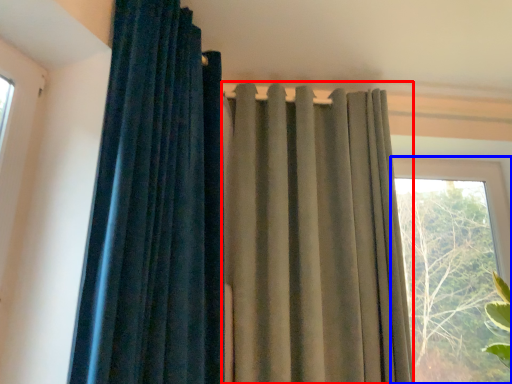
Question: Which point is closer to the camera, curtain (highlighted by a red box) or window (highlighted by a blue box)?

Choices:
 (A) curtain
 (B) window

Answer: (A)